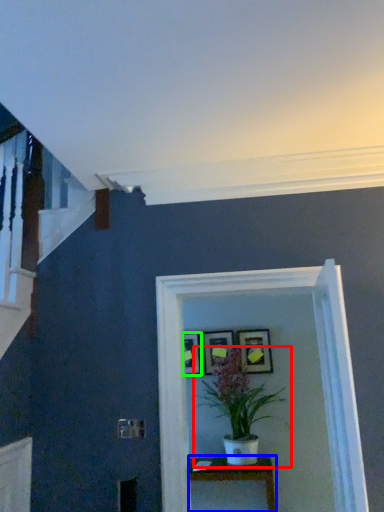
Question: Which is nearer to the houseplant (highlighted by a red box)? table (highlighted by a blue box) or picture frame (highlighted by a green box).

Choices:
 (A) table
 (B) picture frame

Answer: (A)